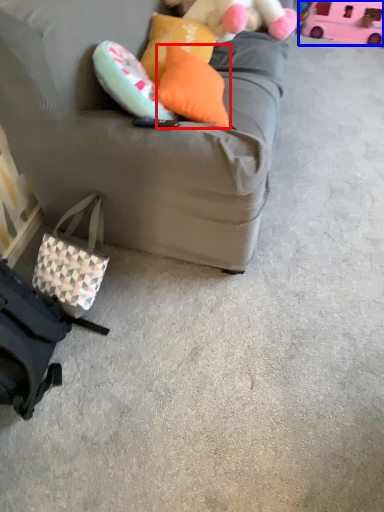
Question: Which point is closer to the camera, pillow (highlighted by a red box) or toy (highlighted by a blue box)?

Choices:
 (A) pillow
 (B) toy

Answer: (A)